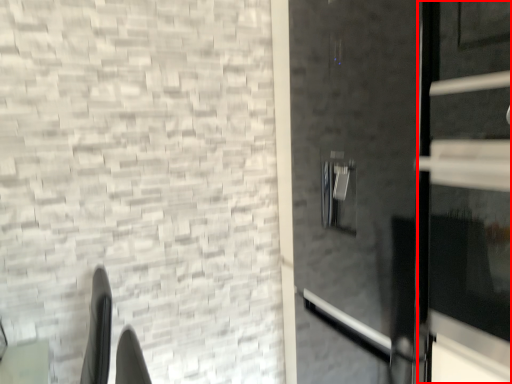
Question: Where is door (annotated by the red box) located in relation to door in the image?

Choices:
 (A) left
 (B) right

Answer: (A)